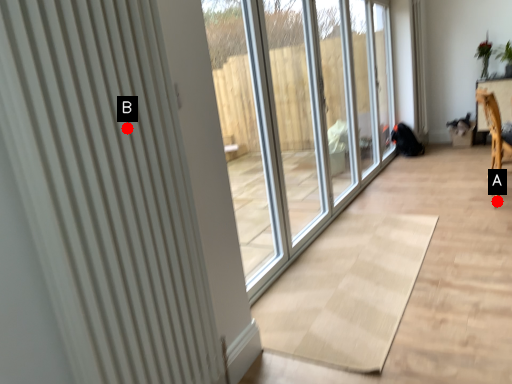
Question: Two points are circled on the image, labeled by A and B beside each circle. Which point is closer to the camera taking this photo?

Choices:
 (A) A is closer
 (B) B is closer

Answer: (B)